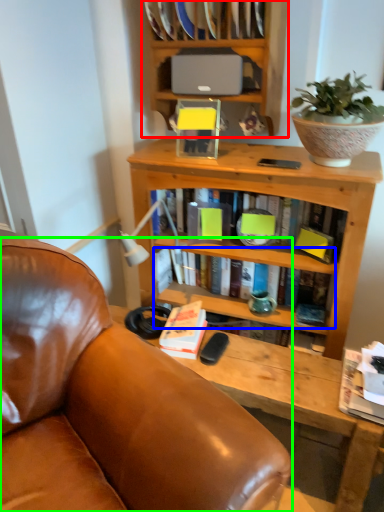
Question: Estimate the real-world distances between objects in this image. Which object is farther from bookcase (highlighted by a red box), book (highlighted by a blue box) or chair (highlighted by a green box)?

Choices:
 (A) book
 (B) chair

Answer: (B)